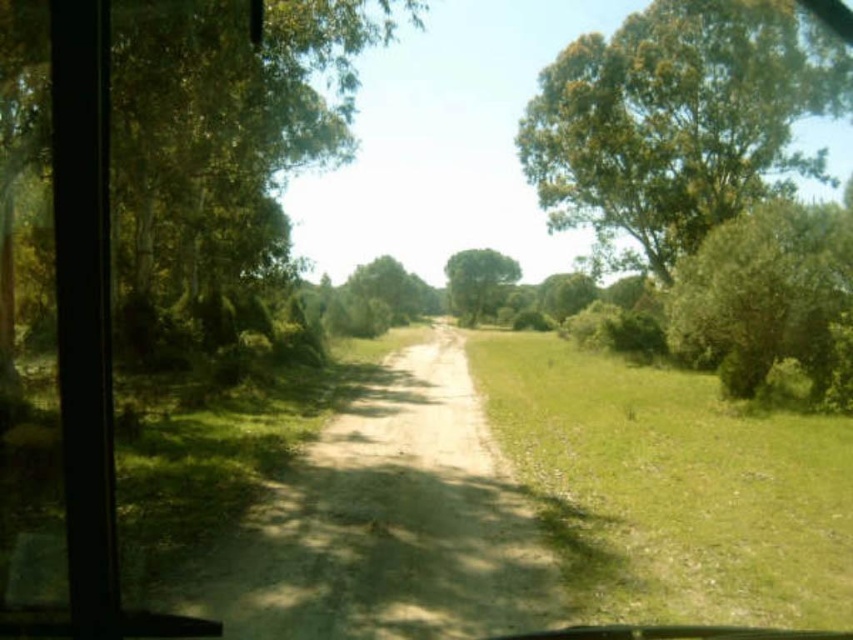
Who is taller, green leafy tree at left or green leafy tree at center?

Standing taller between the two is green leafy tree at center.

Who is lower down, green leafy tree at left or green leafy tree at center?

green leafy tree at left is lower down.

This screenshot has height=640, width=853. What do you see at coordinates (224, 128) in the screenshot?
I see `green leafy tree at left` at bounding box center [224, 128].

Where is `green leafy tree at left`? green leafy tree at left is located at coordinates (224, 128).

Does green grass at center come in front of green leafy tree at left?

Yes, green grass at center is in front of green leafy tree at left.

Can you confirm if green grass at center is taller than green leafy tree at left?

Incorrect, green grass at center's height is not larger of green leafy tree at left's.

You are a GUI agent. You are given a task and a screenshot of the screen. Output one action in this format:
    pyautogui.click(x=<x>, y=<y>)
    Task: Click on the green grass at center
    
    Given the screenshot: What is the action you would take?
    pyautogui.click(x=672, y=486)

Does green grass at center have a greater width compared to green leafy tree at upper right?

No, green grass at center is not wider than green leafy tree at upper right.

Does green grass at center have a greater height compared to green leafy tree at upper right?

No.

Locate an element on the screen. The image size is (853, 640). green grass at center is located at coordinates (672, 486).